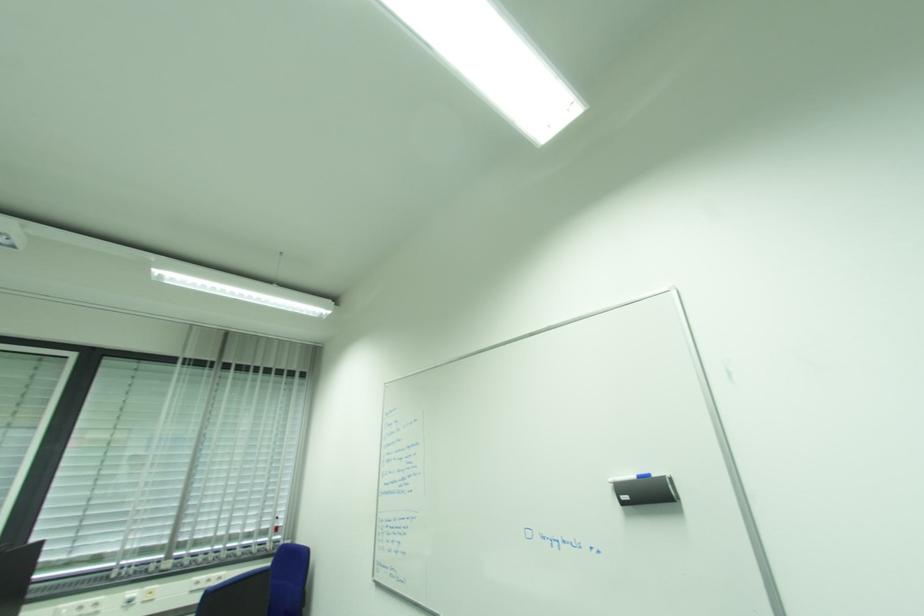
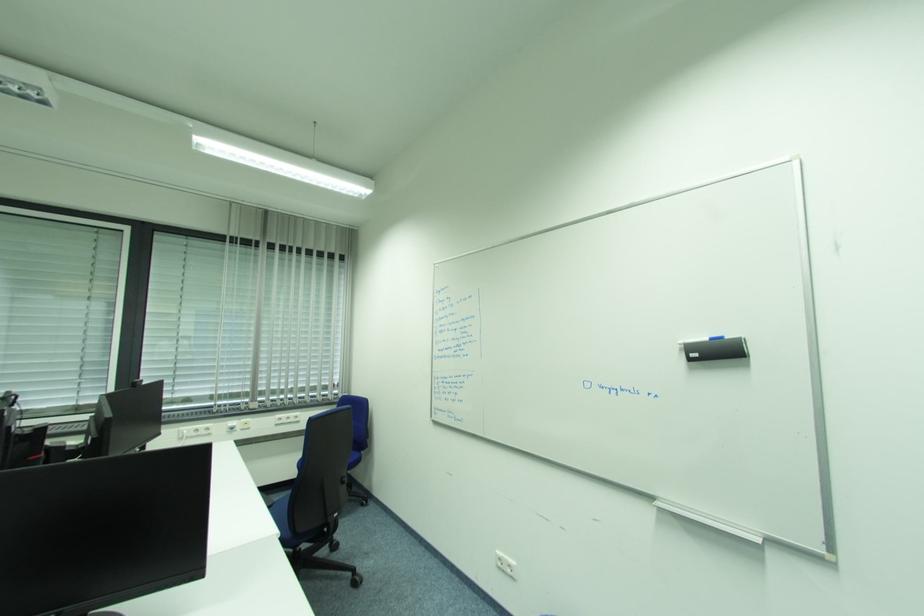
Question: The first image is from the beginning of the video and the second image is from the end. How did the camera likely rotate when shooting the video?

Choices:
 (A) Left
 (B) Right
 (C) Up
 (D) Down

Answer: (D)